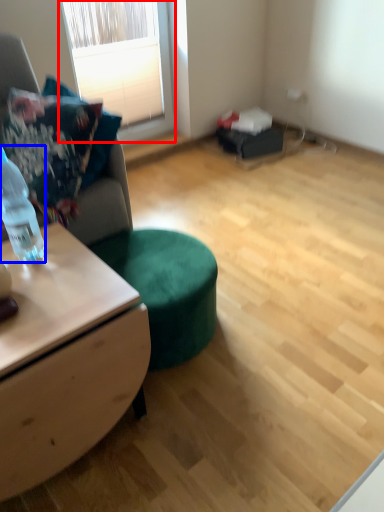
Question: Which of the following is the farthest to the observer, window (highlighted by a red box) or bottle (highlighted by a blue box)?

Choices:
 (A) window
 (B) bottle

Answer: (A)